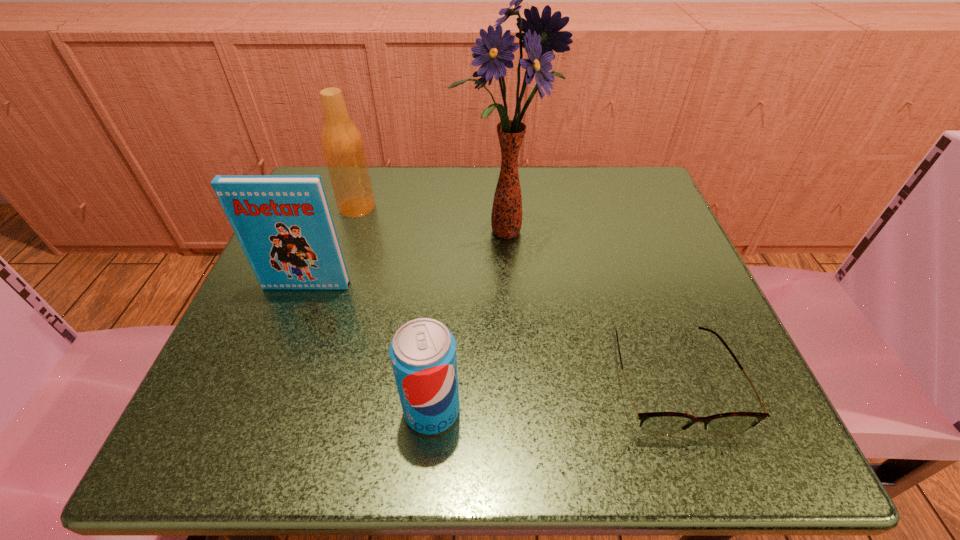
Locate an element on the screen. flower arrangement is located at coordinates (541, 36).

The width and height of the screenshot is (960, 540). What are the coordinates of `beer bottle` in the screenshot? It's located at (342, 144).

In order to click on book in this screenshot , I will do `click(283, 223)`.

Find the location of `the second shortest object`. the second shortest object is located at coordinates (423, 351).

Locate an element on the screen. the rightmost object is located at coordinates (652, 423).

Locate an element on the screen. the shortest object is located at coordinates (652, 423).

Identify the location of free point located on the right of the tallest object. The image size is (960, 540). (582, 232).

The image size is (960, 540). I want to click on free spot located 0.100m on the front of the beer bottle, so click(343, 252).

Find the location of a particular element. The image size is (960, 540). free space located on the front cover of the third nearest object is located at coordinates (264, 396).

At what (x,y) coordinates should I click in order to perform the action: click on vacant area located 0.180m on the back of the fourth tallest object. Please return your answer as a coordinate pair (x, y). Looking at the image, I should click on (442, 292).